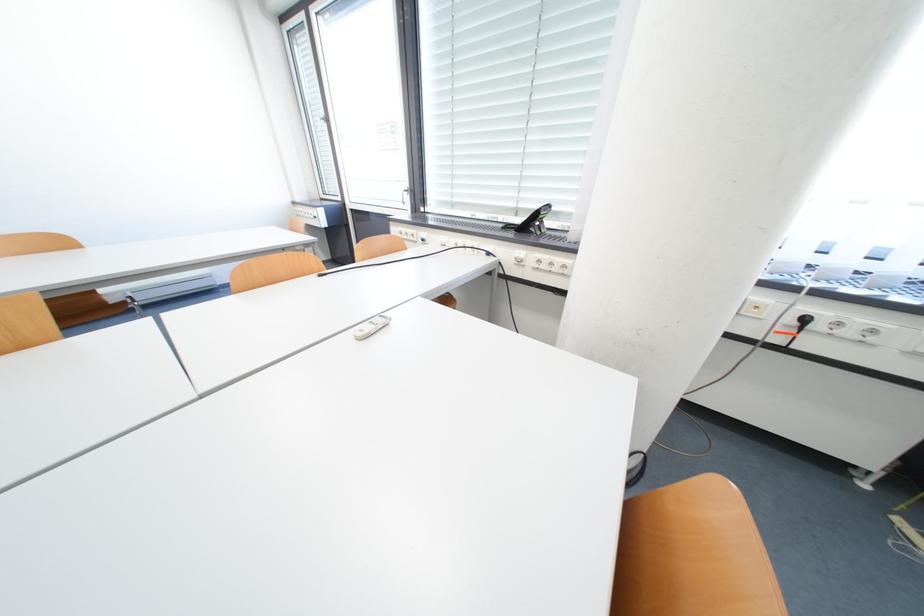
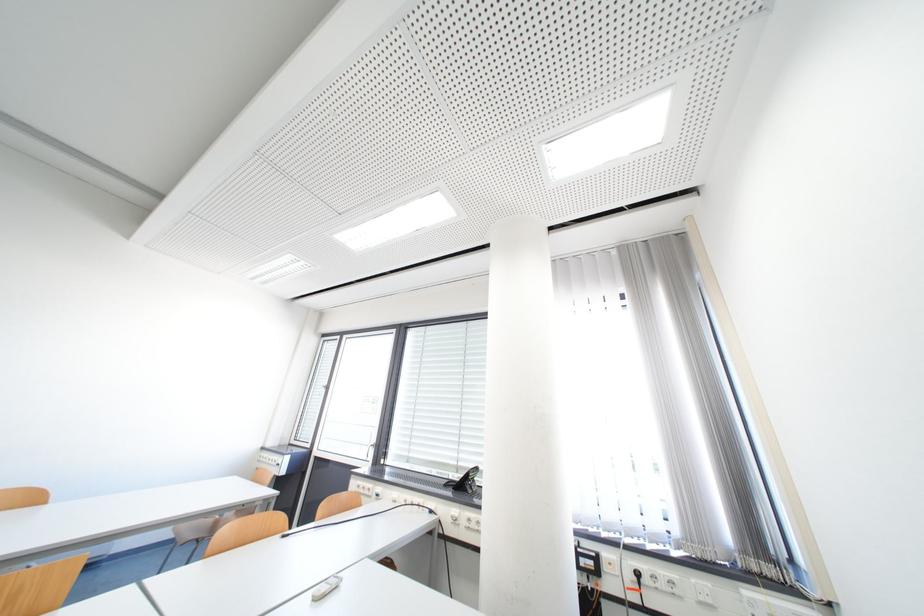
In the second image, find the point that corresponds to pixel 800 322 in the first image.

(639, 578)